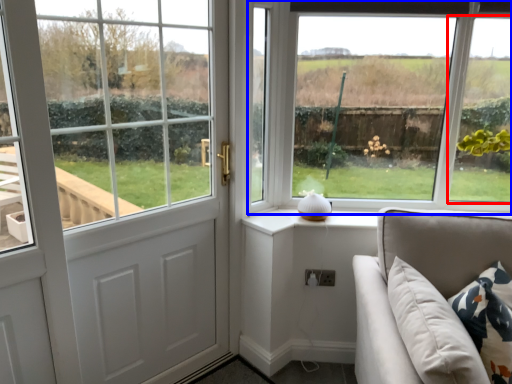
Question: Among these objects, which one is farthest to the camera, window (highlighted by a red box) or window (highlighted by a blue box)?

Choices:
 (A) window
 (B) window

Answer: (B)